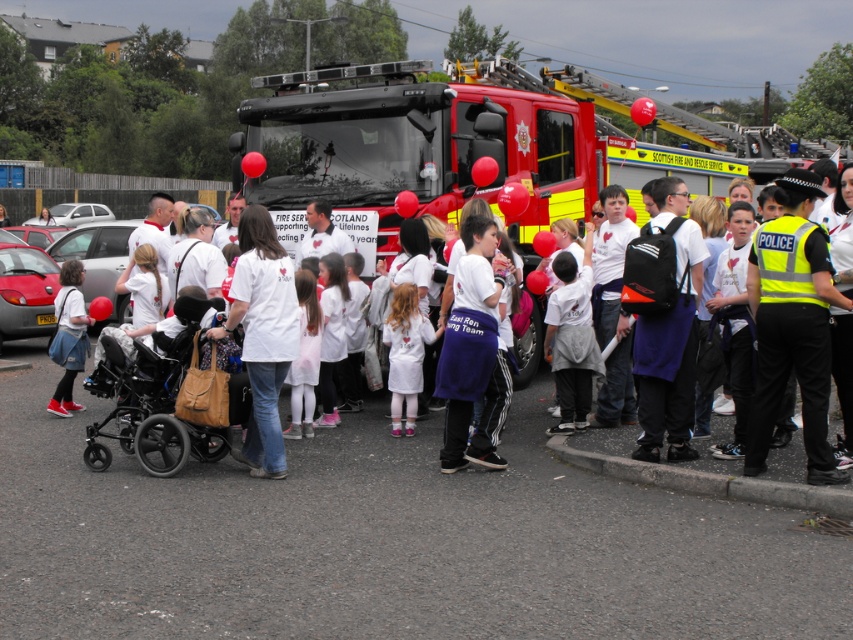
You are standing at the origin point in the image. There are two points marked in the scene. Which point is closer to you, point (265, 112) or point (482, 342)?

Point (482, 342) is closer to you because it is in front of point (265, 112).